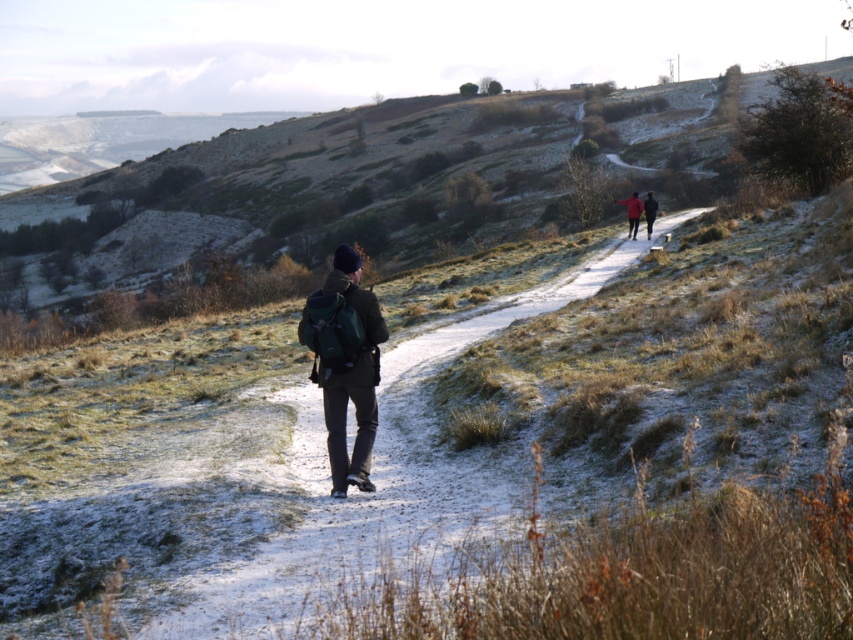
You are a hiker trying to identify two people wearing red jackets in the winter landscape. Which of the two jackets, the red fabric jacket at upper center or the red woolen jacket at upper right, appears smaller in the image?

The red fabric jacket at upper center appears smaller because it occupies less space than the red woolen jacket at upper right.

You are a photographer standing at the starting point of the path. You want to take a photo that includes both the dark green backpack at center and the red woolen jacket at upper right. Which object should you focus on first to ensure both are in sharp focus?

You should focus on the dark green backpack at center first because it is closer to you than the red woolen jacket at upper right. By focusing on the closer object, the farther one will also be in focus due to the depth of field.